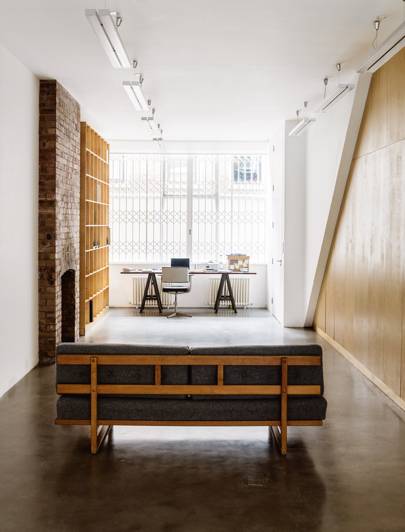
Find the location of `brown wooden sofa frame`. brown wooden sofa frame is located at coordinates (122, 423), (92, 435), (134, 360), (145, 394), (159, 378), (222, 378), (282, 413).